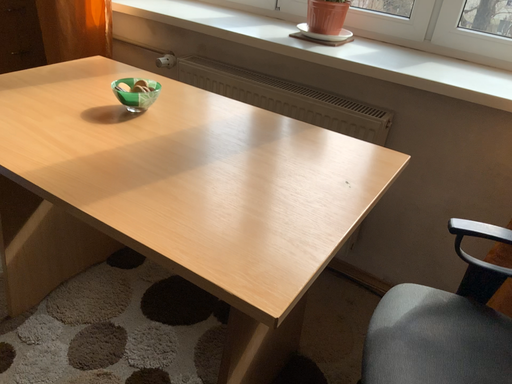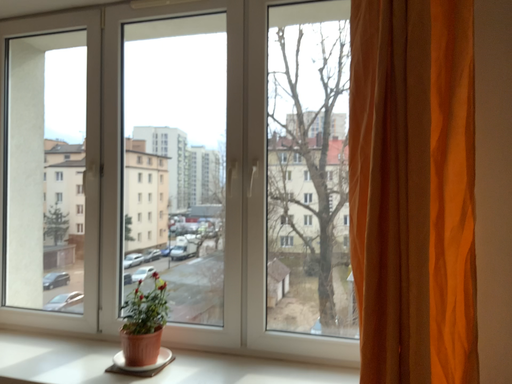
Question: Which way did the camera rotate in the video?

Choices:
 (A) rotated right
 (B) rotated left

Answer: (A)